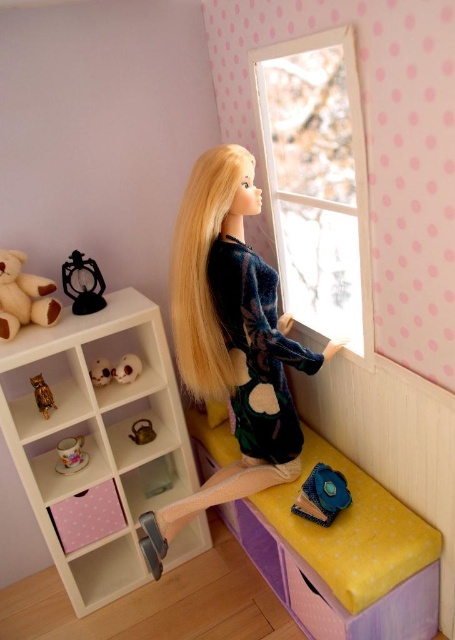
You are a child playing in the miniature room. You want to see outside through the clear glass window at upper center but the shiny gold owl at left is blocking your view. How can you move the owl to see outside?

The clear glass window at upper center is positioned over the shiny gold owl at left, so you can move the shiny gold owl at left to the side or remove it from its current location to unblock the view through the clear glass window at upper center.

You are a tiny house enthusiast inspecting the miniature room. You notice the metallic clock at upper left and the gold metallic teapot at lower left. Which object is taller?

The metallic clock at upper left is taller than the gold metallic teapot at lower left according to the description.

You are a small toy mouse that is 10 cm tall. You want to move from the shiny gold owl at left to the clear glass window at upper center. Can you fit through the space between them?

The clear glass window at upper center and shiny gold owl at left are 1.18 meters apart from each other. Since the toy mouse is only 10 cm tall, it can easily move through the space between them as the distance is more than sufficient for its size.